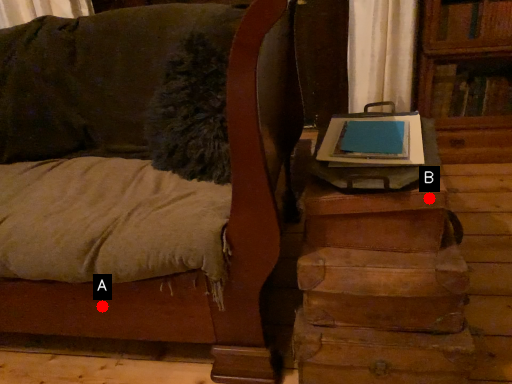
Question: Two points are circled on the image, labeled by A and B beside each circle. Which point is farther to the camera?

Choices:
 (A) A is further
 (B) B is further

Answer: (A)